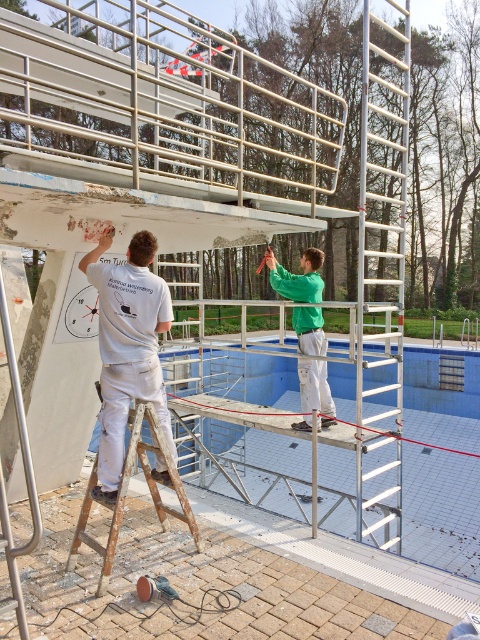
Question: Which point is closer to the camera?

Choices:
 (A) silver metallic ladder at upper center
 (B) blue tile swimming pool at center
 (C) rusty wood ladder at lower left
 (D) white matte t-shirt at upper left

Answer: (C)

Question: Which of these objects is positioned farthest from the rusty wood ladder at lower left?

Choices:
 (A) silver metallic ladder at upper center
 (B) blue tile swimming pool at center
 (C) green matte shirt at center

Answer: (A)

Question: Is silver metallic ladder at upper center smaller than green matte shirt at center?

Choices:
 (A) yes
 (B) no

Answer: (B)

Question: Based on their relative distances, which object is nearer to the green matte shirt at center?

Choices:
 (A) rusty wood ladder at lower left
 (B) white matte t-shirt at upper left
 (C) blue tile swimming pool at center

Answer: (A)

Question: Is blue tile swimming pool at center above white matte t-shirt at upper left?

Choices:
 (A) yes
 (B) no

Answer: (B)

Question: Can you confirm if blue tile swimming pool at center is positioned to the left of silver metallic ladder at upper center?

Choices:
 (A) no
 (B) yes

Answer: (B)